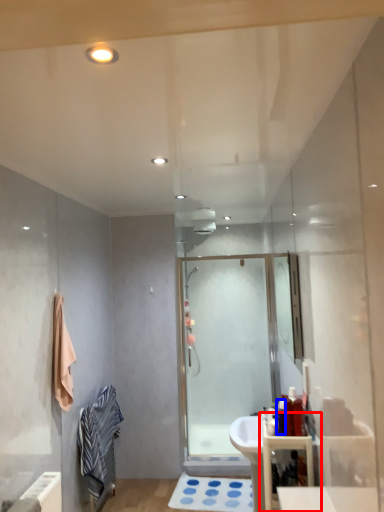
Question: Which point is further to the camera, bathroom cabinet (highlighted by a red box) or toiletry (highlighted by a blue box)?

Choices:
 (A) bathroom cabinet
 (B) toiletry

Answer: (B)